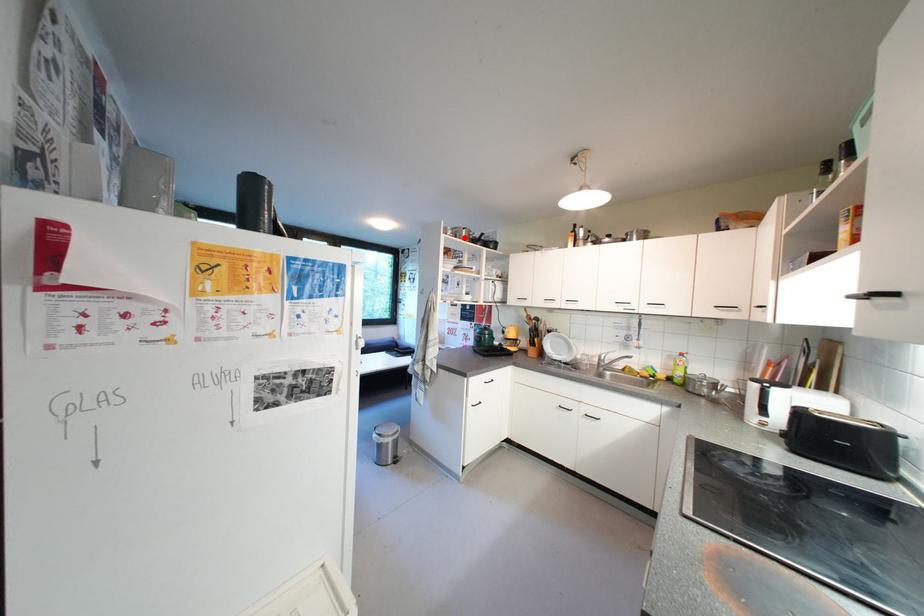
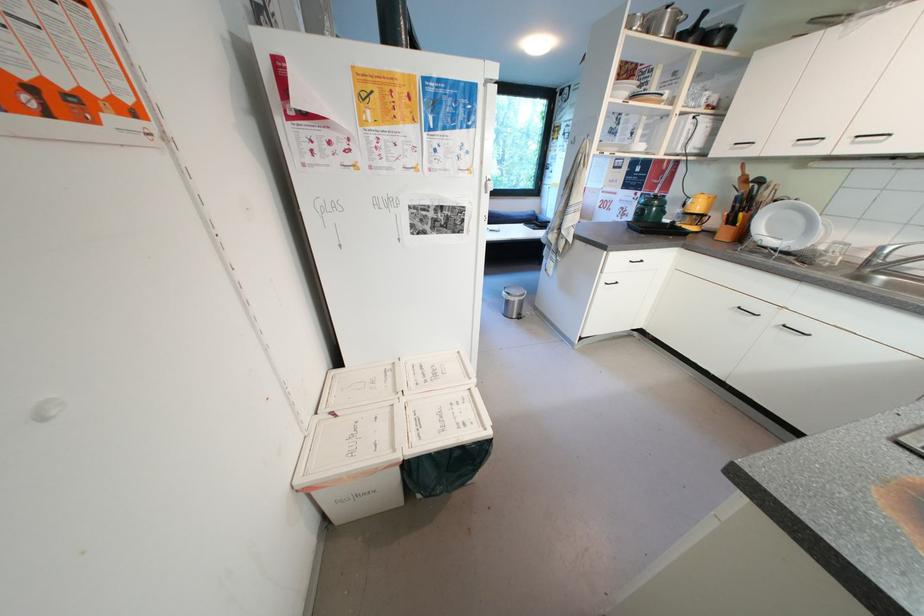
The point at the highlighted location is marked in the first image. Where is the corresponding point in the second image?

(657, 33)